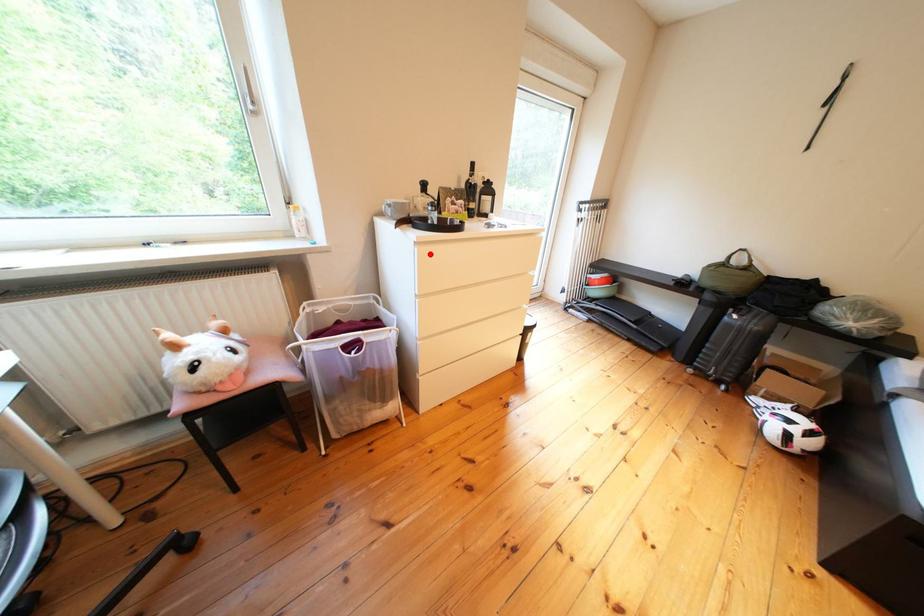
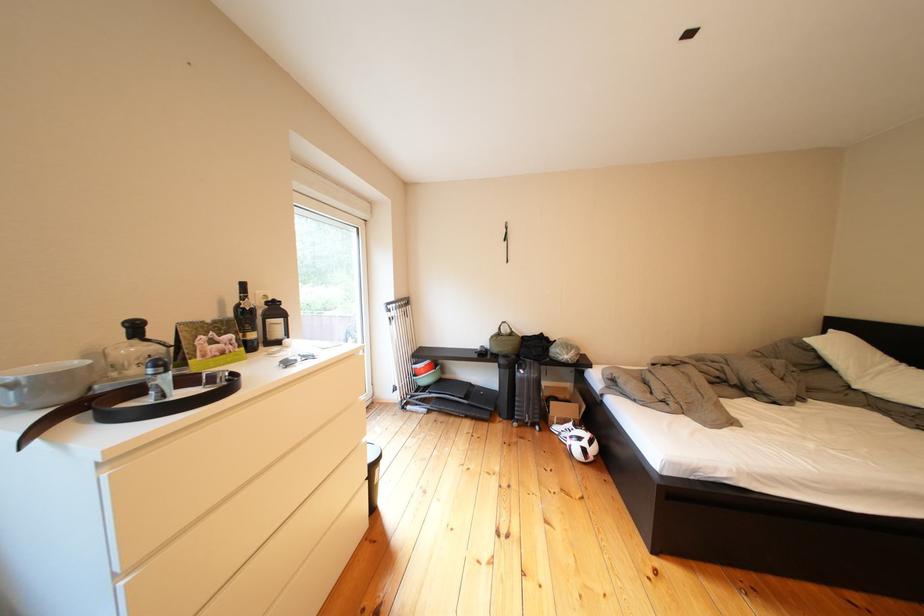
Locate, in the second image, the point that corresponds to the highlighted location in the first image.

(118, 482)